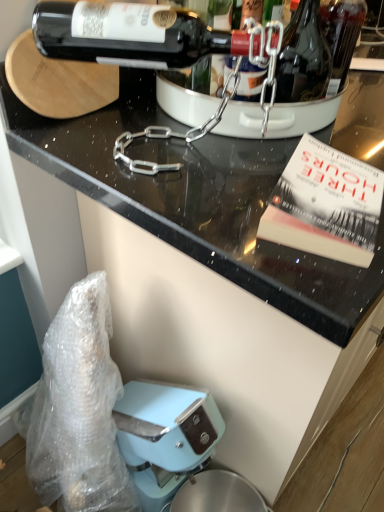
Question: Considering the positions of point (198, 82) and point (342, 172), is point (198, 82) closer or farther from the camera than point (342, 172)?

Choices:
 (A) closer
 (B) farther

Answer: (B)

Question: From their relative heights in the image, would you say shiny dark glass bottle at upper center is taller or shorter than hardcover book at upper right?

Choices:
 (A) short
 (B) tall

Answer: (B)

Question: Which of these objects is positioned farthest from the black glossy countertop at upper center?

Choices:
 (A) shiny dark glass bottle at upper center
 (B) hardcover book at upper right
 (C) shiny dark glass bottle at upper right

Answer: (A)

Question: Considering the real-world distances, which object is farthest from the hardcover book at upper right?

Choices:
 (A) black glossy countertop at upper center
 (B) shiny dark glass bottle at upper center
 (C) shiny dark glass bottle at upper right

Answer: (B)